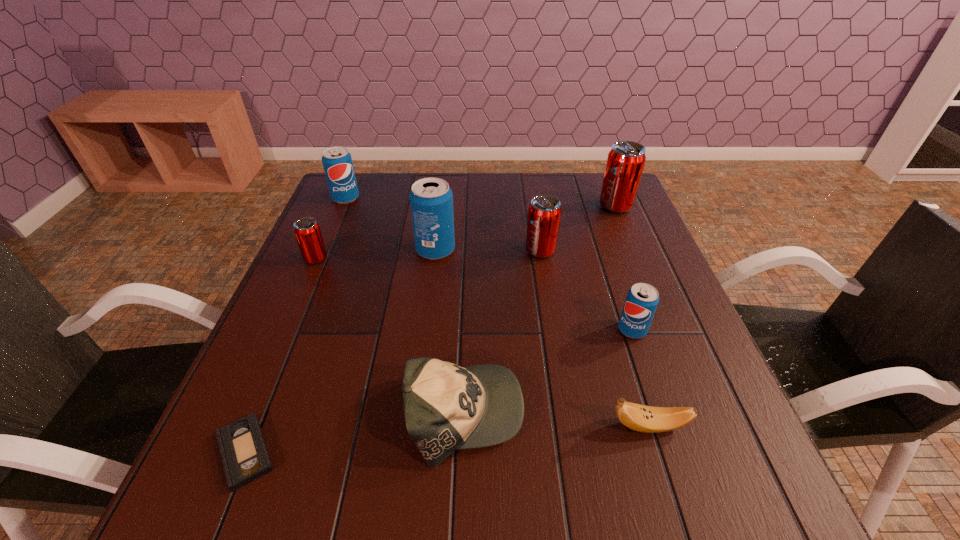
This screenshot has height=540, width=960. I want to click on the second closest blue soda can relative to the second smallest red soda can, so click(642, 299).

Choose which red soda can is the second nearest neighbor to the biggest blue soda can. Please provide its 2D coordinates. Your answer should be formatted as a tuple, i.e. [(x, y)], where the tuple contains the x and y coordinates of a point satisfying the conditions above.

[(307, 231)]

Locate an element on the screen. The width and height of the screenshot is (960, 540). red soda can that is the second nearest to the baseball cap is located at coordinates (307, 231).

Locate an element on the screen. The width and height of the screenshot is (960, 540). blank area in the image that satisfies the following two spatial constraints: 1. on the front-facing side of the baseball cap; 2. on the front side of the shortest object is located at coordinates (463, 453).

Find the location of a particular element. vacant point that satisfies the following two spatial constraints: 1. on the front side of the rightmost blue soda can; 2. on the right side of the second smallest red soda can is located at coordinates (553, 330).

Find the location of `vacant region that satisfies the following two spatial constraints: 1. on the back side of the banana; 2. on the right side of the shortest object`. vacant region that satisfies the following two spatial constraints: 1. on the back side of the banana; 2. on the right side of the shortest object is located at coordinates (256, 427).

This screenshot has width=960, height=540. Identify the location of vacant space that satisfies the following two spatial constraints: 1. on the front side of the fourth soda can from right to left; 2. on the left side of the nearest soda can. click(x=426, y=330).

This screenshot has width=960, height=540. Identify the location of vacant area in the image that satisfies the following two spatial constraints: 1. on the back side of the videotape; 2. on the right side of the second red soda can from right to left. (327, 251).